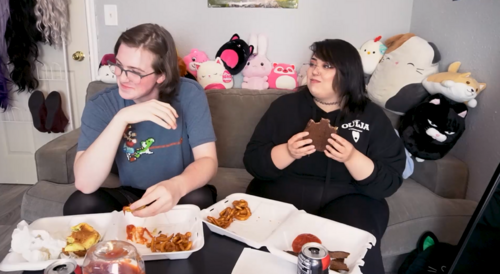
Locate an element on the screen. The image size is (500, 274). frame is located at coordinates (265, 10).